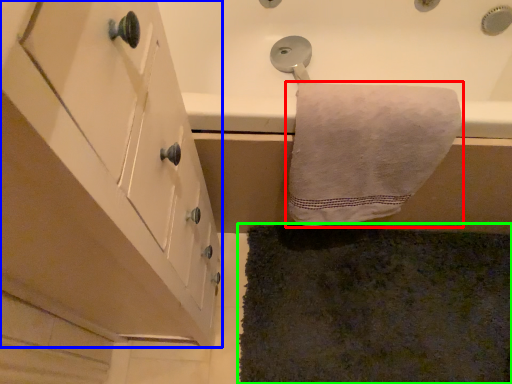
Question: Estimate the real-world distances between objects in this image. Which object is farther from towel (highlighted by a red box), cabinetry (highlighted by a blue box) or bath mat (highlighted by a green box)?

Choices:
 (A) cabinetry
 (B) bath mat

Answer: (B)